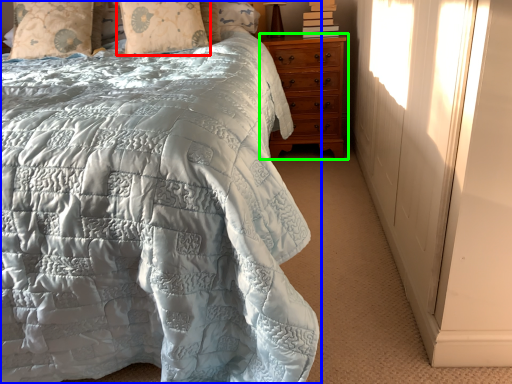
Question: Based on their relative distances, which object is farther from pillow (highlighted by a red box)? Choose from bed (highlighted by a blue box) and chest of drawers (highlighted by a green box).

Choices:
 (A) bed
 (B) chest of drawers

Answer: (A)